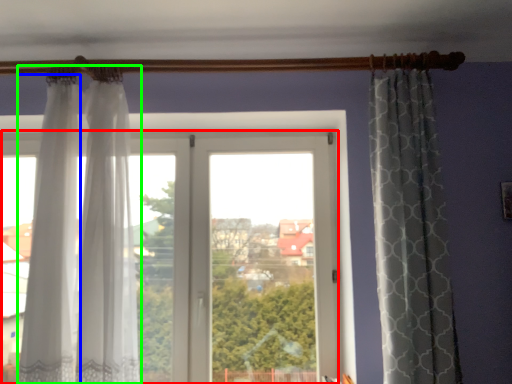
Question: Which is nearer to the window (highlighted by a red box)? curtain (highlighted by a blue box) or curtain (highlighted by a green box).

Choices:
 (A) curtain
 (B) curtain

Answer: (B)